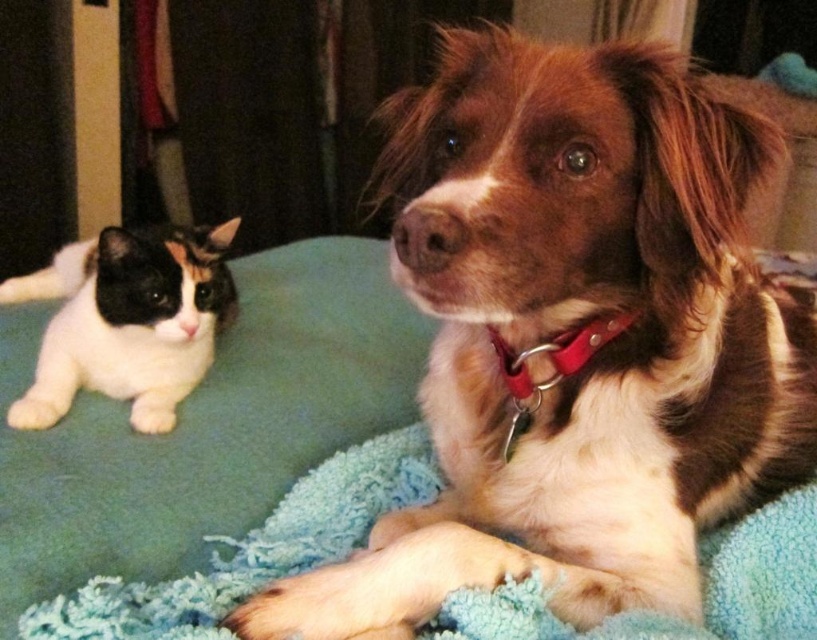
You are trying to decide whether to place a small toy on the blue textured blanket at lower center or next to the white fur cat at left. Which surface has enough space for the toy?

The blue textured blanket at lower center has enough space for the toy because its width is larger than the white fur cat at left.

You are a pet sitter who needs to separate the brown furry dog at center and the white fur cat at left into two separate rooms. The doorway you must use is only 40 centimeters wide. Can both animals pass through the doorway simultaneously without any issues?

The brown furry dog at center and the white fur cat at left are 39.96 centimeters apart, which is just under 40 centimeters. Therefore, both animals can pass through the doorway simultaneously without any issues as their combined width is within the doorway width.

You are a pet owner trying to decide whether to buy a new dog bed for your brown furry dog at center. The bed you want is the size of the blue textured blanket at lower center. Based on the image, will the bed be big enough for your dog to lie comfortably?

The brown furry dog at center is wider than the blue textured blanket at lower center, so the bed might not be large enough for the dog to lie comfortably.